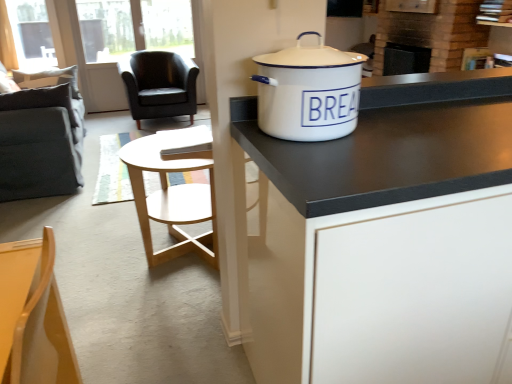
Find the location of `vacant space in front of white enamel pot at upper right`. vacant space in front of white enamel pot at upper right is located at coordinates (343, 165).